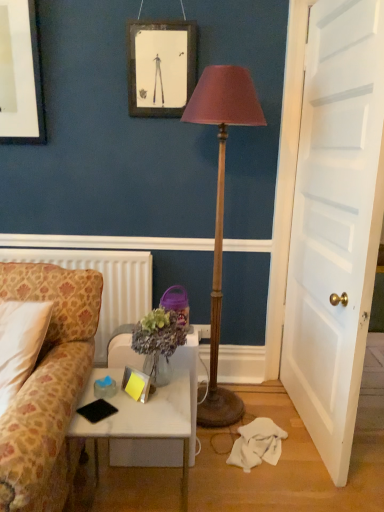
You are a GUI agent. You are given a task and a screenshot of the screen. Output one action in this format:
    pyautogui.click(x=<x>, y=<y>)
    Task: Click on the blue translucent cup at lower left
    
    Given the screenshot: What is the action you would take?
    pyautogui.click(x=105, y=387)

Where is `white textured radiator at left`? The width and height of the screenshot is (384, 512). white textured radiator at left is located at coordinates (103, 283).

This screenshot has height=512, width=384. What do you see at coordinates (48, 386) in the screenshot? I see `patterned fabric couch at left` at bounding box center [48, 386].

The width and height of the screenshot is (384, 512). Find the location of `wooden framed picture at upper center`. wooden framed picture at upper center is located at coordinates (161, 67).

From a real-world perspective, is wooden framed picture at upper center on top of patterned fabric couch at left?

Correct, in the physical world, wooden framed picture at upper center is higher than patterned fabric couch at left.

Is wooden framed picture at upper center far from patterned fabric couch at left?

That's right, there is a large distance between wooden framed picture at upper center and patterned fabric couch at left.

Which object is wider, wooden framed picture at upper center or patterned fabric couch at left?

patterned fabric couch at left is wider.

How many degrees apart are the facing directions of white wooden door at right and wooden framed picture at upper center?

The angular difference between white wooden door at right and wooden framed picture at upper center is 86.5 degrees.

Is wooden framed picture at upper center inside white wooden door at right?

Actually, wooden framed picture at upper center is outside white wooden door at right.

Is white wooden door at right positioned far away from wooden framed picture at upper center?

Actually, white wooden door at right and wooden framed picture at upper center are a little close together.

Considering their positions, is white wooden door at right located in front of or behind wooden framed picture at upper center?

In the image, white wooden door at right appears in front of wooden framed picture at upper center.

Is wooden framed picture at upper center with wooden floor lamp at center?

They are not placed beside each other.

Consider the image. Is wooden framed picture at upper center taller than wooden floor lamp at center?

In fact, wooden framed picture at upper center may be shorter than wooden floor lamp at center.

Are blue translucent cup at lower left and wooden floor lamp at center beside each other?

blue translucent cup at lower left and wooden floor lamp at center are not in contact.

Is blue translucent cup at lower left turned away from wooden floor lamp at center?

blue translucent cup at lower left does not have its back to wooden floor lamp at center.

Between blue translucent cup at lower left and wooden floor lamp at center, which one has larger width?

wooden floor lamp at center.

In the image, there is a wooden floor lamp at center. Where is `coffee cup below it (from a real-world perspective)`? Image resolution: width=384 pixels, height=512 pixels. coffee cup below it (from a real-world perspective) is located at coordinates (105, 387).

From a real-world perspective, is white marble desk at lower left on patterned fabric couch at left?

No, from a real-world perspective, white marble desk at lower left is not above patterned fabric couch at left.

Is white marble desk at lower left at the left side of patterned fabric couch at left?

Incorrect, white marble desk at lower left is not on the left side of patterned fabric couch at left.

Does point (150, 411) lie behind point (43, 407)?

That is True.

From their relative heights in the image, would you say white textured radiator at left is taller or shorter than white wooden door at right?

Clearly, white textured radiator at left is shorter compared to white wooden door at right.

Looking at this image, is the surface of white textured radiator at left in direct contact with white wooden door at right?

No, white textured radiator at left is not making contact with white wooden door at right.

Consider the image. From the image's perspective, which is above, white textured radiator at left or white wooden door at right?

white wooden door at right appears higher in the image.

Is there a large distance between wooden framed picture at upper center and blue translucent cup at lower left?

Absolutely, wooden framed picture at upper center is distant from blue translucent cup at lower left.

Is blue translucent cup at lower left a part of wooden framed picture at upper center?

No.

Does wooden framed picture at upper center come behind blue translucent cup at lower left?

That is True.

Is wooden framed picture at upper center at the right side of blue translucent cup at lower left?

Yes, wooden framed picture at upper center is to the right of blue translucent cup at lower left.

The height and width of the screenshot is (512, 384). I want to click on studio couch below the wooden framed picture at upper center (from a real-world perspective), so click(x=48, y=386).

The image size is (384, 512). I want to click on picture frame above the white wooden door at right (from the image's perspective), so click(161, 67).

Based on their spatial positions, is white wooden door at right or blue translucent cup at lower left closer to white textured radiator at left?

Among the two, blue translucent cup at lower left is located nearer to white textured radiator at left.

Looking at the image, which one is located further to white marble desk at lower left, wooden floor lamp at center or patterned fabric couch at left?

wooden floor lamp at center lies further to white marble desk at lower left than the other object.

Which object lies further to the anchor point white marble desk at lower left, blue translucent cup at lower left or white wooden door at right?

white wooden door at right is further to white marble desk at lower left.

Looking at the image, which one is located closer to blue translucent cup at lower left, patterned fabric couch at left or white textured radiator at left?

patterned fabric couch at left is positioned closer to the anchor blue translucent cup at lower left.

Based on their spatial positions, is white textured radiator at left or patterned fabric couch at left further from white marble desk at lower left?

Among the two, white textured radiator at left is located further to white marble desk at lower left.

When comparing their distances from wooden floor lamp at center, does wooden framed picture at upper center or white marble desk at lower left seem closer?

wooden framed picture at upper center is closer to wooden floor lamp at center.

When comparing their distances from patterned fabric couch at left, does white textured radiator at left or white wooden door at right seem further?

white wooden door at right is positioned further to the anchor patterned fabric couch at left.

Looking at the image, which one is located further to wooden floor lamp at center, white marble desk at lower left or blue translucent cup at lower left?

blue translucent cup at lower left is further to wooden floor lamp at center.

Image resolution: width=384 pixels, height=512 pixels. In order to click on radiator that lies between wooden framed picture at upper center and white marble desk at lower left from top to bottom in this screenshot , I will do `click(103, 283)`.

Locate an element on the screen. This screenshot has width=384, height=512. lamp between wooden framed picture at upper center and white textured radiator at left vertically is located at coordinates (221, 206).

This screenshot has width=384, height=512. In order to click on lamp positioned between patterned fabric couch at left and white textured radiator at left from near to far in this screenshot , I will do `click(221, 206)`.

You are a GUI agent. You are given a task and a screenshot of the screen. Output one action in this format:
    pyautogui.click(x=<x>, y=<y>)
    Task: Click on the door between wooden framed picture at upper center and patterned fabric couch at left in the vertical direction
    
    Given the screenshot: What is the action you would take?
    pyautogui.click(x=335, y=223)